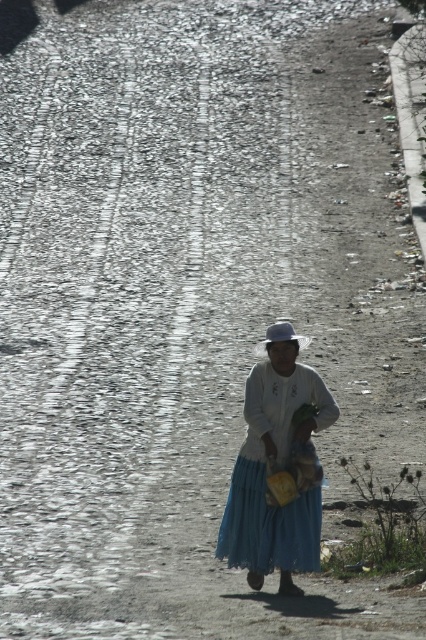
Can you confirm if white cotton dress at center is positioned to the right of natural straw hat at center?

In fact, white cotton dress at center is to the left of natural straw hat at center.

Is white cotton dress at center positioned in front of natural straw hat at center?

Yes, it is in front of natural straw hat at center.

Describe the element at coordinates (278, 467) in the screenshot. I see `white cotton dress at center` at that location.

Locate an element on the screen. This screenshot has height=640, width=426. white cotton dress at center is located at coordinates (278, 467).